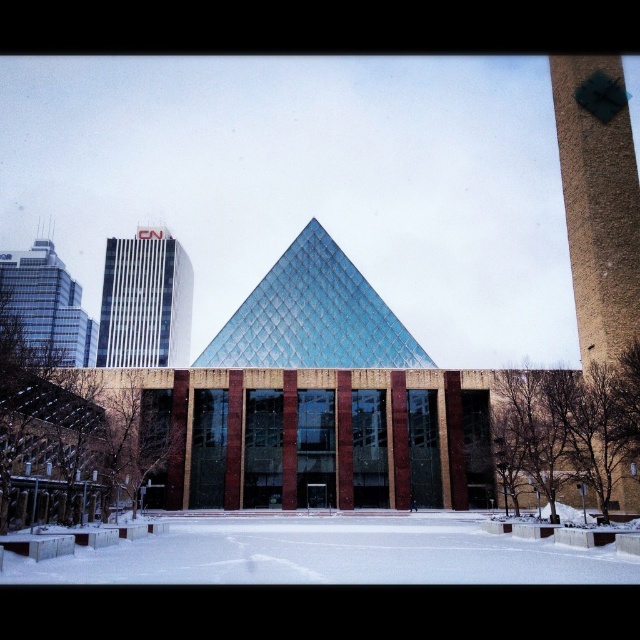
You are standing at the entrance of the building and looking towards the snow. There is a point marked at coordinates point (598,202). What object is located at that point?

The point (598,202) indicates a brown textured tower at right.

You are standing at the center of the snow covered ground in front of the building. You see a point marked at coordinate (145, 301). What does this point correspond to?

The point corresponds to the white glass building at upper left.

You are standing at the camera position and want to walk directly to the brown textured tower at right. How far will you have to walk?

The brown textured tower at right is 44.24 meters away from the camera, so you will have to walk 44.24 meters to reach it.